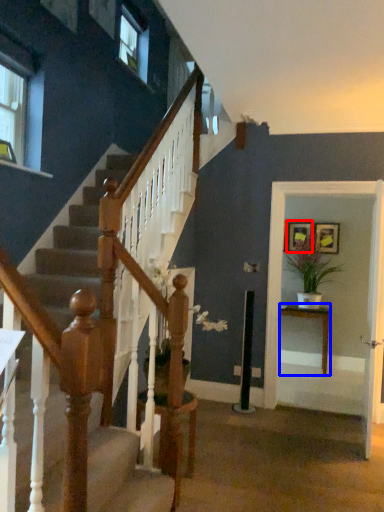
Question: Which object appears farthest to the camera in this image, picture frame (highlighted by a red box) or table (highlighted by a blue box)?

Choices:
 (A) picture frame
 (B) table

Answer: (A)